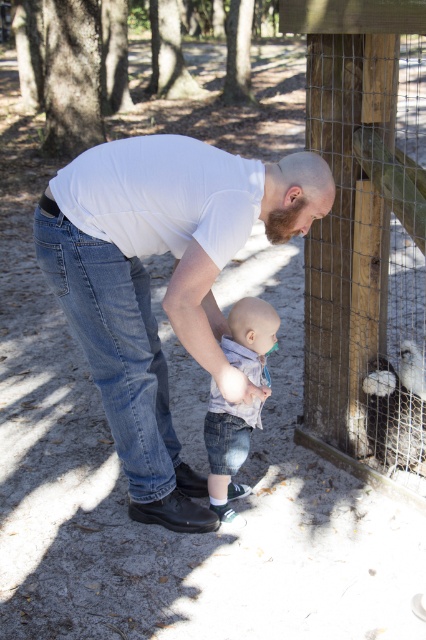
Question: Does wooden post at right have a lesser width compared to denim shorts at center?

Choices:
 (A) no
 (B) yes

Answer: (A)

Question: Which object is positioned closest to the denim shorts at center?

Choices:
 (A) wooden post at right
 (B) white matte shirt at center

Answer: (B)

Question: Which point appears farthest from the camera in this image?

Choices:
 (A) (345, 168)
 (B) (219, 410)

Answer: (A)

Question: Can you confirm if white matte shirt at center is wider than denim shorts at center?

Choices:
 (A) no
 (B) yes

Answer: (B)

Question: Is white matte shirt at center thinner than denim shorts at center?

Choices:
 (A) no
 (B) yes

Answer: (A)

Question: Which of these objects is positioned closest to the denim shorts at center?

Choices:
 (A) wooden post at right
 (B) white matte shirt at center

Answer: (B)